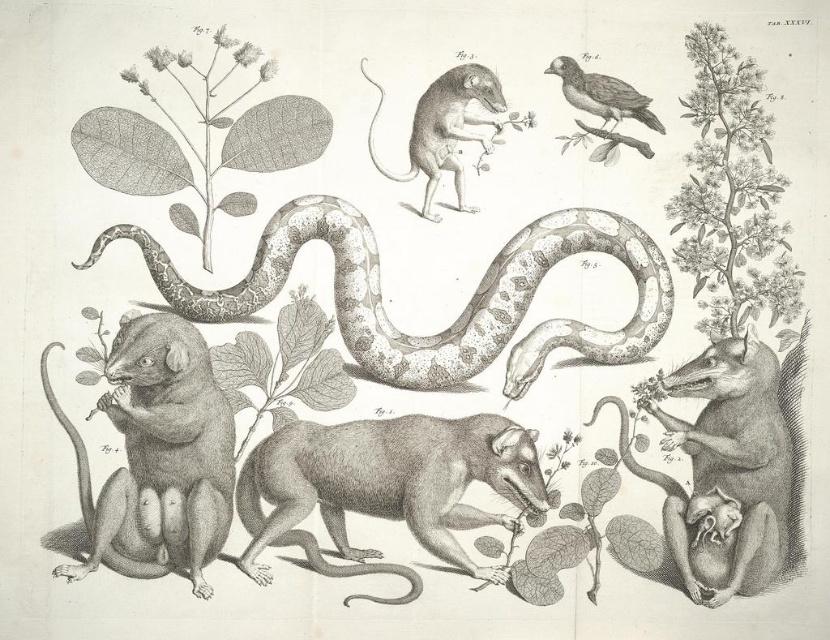
Which is more to the right, brown furry rodent at lower left or smooth gray leaf at center?

From the viewer's perspective, smooth gray leaf at center appears more on the right side.

Does point (193, 381) lie behind point (276, 388)?

No, it is in front of (276, 388).

Is point (171, 540) positioned before point (315, 385)?

That is True.

Where is `brown furry rodent at lower left`? brown furry rodent at lower left is located at coordinates (164, 452).

Locate an element on the screen. brown furry rodent at center is located at coordinates (389, 481).

Is brown furry rodent at center to the left of brown feathered bird at upper right from the viewer's perspective?

Correct, you'll find brown furry rodent at center to the left of brown feathered bird at upper right.

You are a GUI agent. You are given a task and a screenshot of the screen. Output one action in this format:
    pyautogui.click(x=<x>, y=<y>)
    Task: Click on the brown furry rodent at center
    The width and height of the screenshot is (830, 640).
    Given the screenshot: What is the action you would take?
    pyautogui.click(x=389, y=481)

In order to click on smooth gray mouse at center in this screenshot , I will do `click(447, 128)`.

Is point (514, 124) more distant than point (560, 58)?

No, (514, 124) is closer to viewer.

Where is `smooth gray mouse at center`? The image size is (830, 640). smooth gray mouse at center is located at coordinates (447, 128).